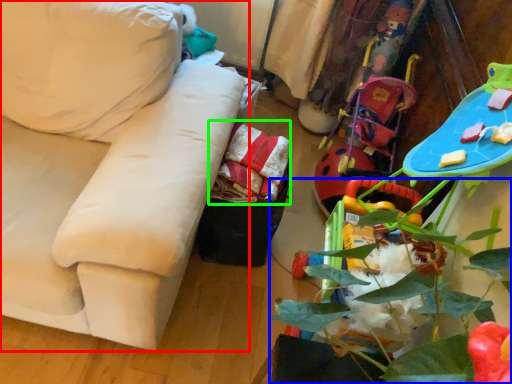
Question: Estimate the real-world distances between objects in this image. Which object is farther from studio couch (highlighted by a red box), plant (highlighted by a blue box) or material (highlighted by a green box)?

Choices:
 (A) plant
 (B) material

Answer: (A)